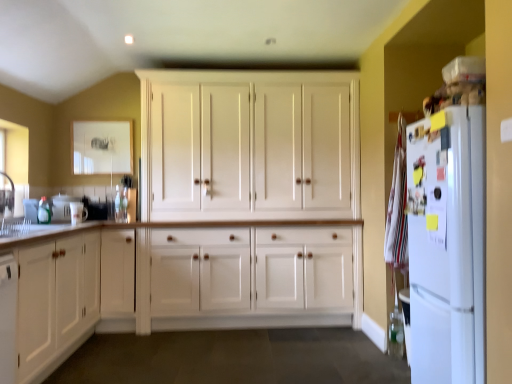
Question: Should I look upward or downward to see white matte refrigerator at right?

Choices:
 (A) down
 (B) up

Answer: (A)

Question: Is white wood cabinet at center, arranged as the 1th cabinetry when viewed from the back, further to the viewer compared to white wood cabinet at left, which appears as the 1th cabinetry when viewed from the front?

Choices:
 (A) yes
 (B) no

Answer: (A)

Question: Is white wood cabinet at left, acting as the first cabinetry starting from the left, located within white wood cabinet at center, the first cabinetry when ordered from right to left?

Choices:
 (A) yes
 (B) no

Answer: (B)

Question: From a real-world perspective, is white wood cabinet at center, marked as the 2th cabinetry in a front-to-back arrangement, physically above white wood cabinet at left, which appears as the second cabinetry when viewed from the back?

Choices:
 (A) no
 (B) yes

Answer: (B)

Question: Is white wood cabinet at center, the first cabinetry when ordered from right to left, positioned with its back to white wood cabinet at left, acting as the first cabinetry starting from the left?

Choices:
 (A) yes
 (B) no

Answer: (B)

Question: Would you consider white wood cabinet at center, positioned as the 2th cabinetry in left-to-right order, to be distant from white wood cabinet at left, which appears as the 1th cabinetry when viewed from the front?

Choices:
 (A) yes
 (B) no

Answer: (A)

Question: Is white wood cabinet at center, positioned as the 2th cabinetry in left-to-right order, thinner than white wood cabinet at left, which is the second cabinetry in right-to-left order?

Choices:
 (A) yes
 (B) no

Answer: (A)

Question: Is white wood cabinet at center, arranged as the 1th cabinetry when viewed from the back, positioned behind white glossy sink at left?

Choices:
 (A) yes
 (B) no

Answer: (B)

Question: Is white wood cabinet at center, the first cabinetry when ordered from right to left, wider than white glossy sink at left?

Choices:
 (A) no
 (B) yes

Answer: (B)

Question: Could white glossy sink at left be considered to be inside white wood cabinet at center, positioned as the 2th cabinetry in left-to-right order?

Choices:
 (A) yes
 (B) no

Answer: (B)

Question: Is white wood cabinet at center, positioned as the 2th cabinetry in left-to-right order, taller than white glossy sink at left?

Choices:
 (A) no
 (B) yes

Answer: (B)

Question: Is white wood cabinet at center, arranged as the 1th cabinetry when viewed from the back, looking in the opposite direction of white glossy sink at left?

Choices:
 (A) yes
 (B) no

Answer: (B)

Question: From the image's perspective, is white wood cabinet at center, positioned as the 2th cabinetry in left-to-right order, located beneath white glossy sink at left?

Choices:
 (A) yes
 (B) no

Answer: (B)

Question: Can we say white glossy mug at left lies outside white wood cabinet at left, which is the second cabinetry in right-to-left order?

Choices:
 (A) yes
 (B) no

Answer: (A)